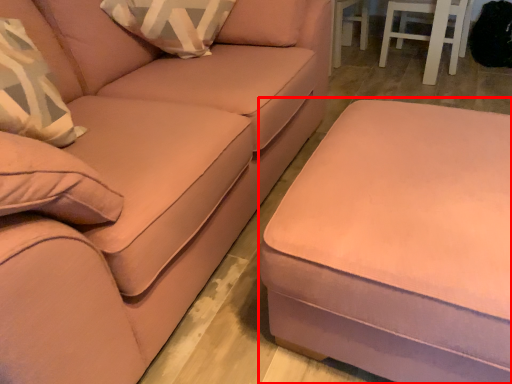
Question: From the image's perspective, where is table (annotated by the red box) located relative to studio couch?

Choices:
 (A) below
 (B) above

Answer: (A)